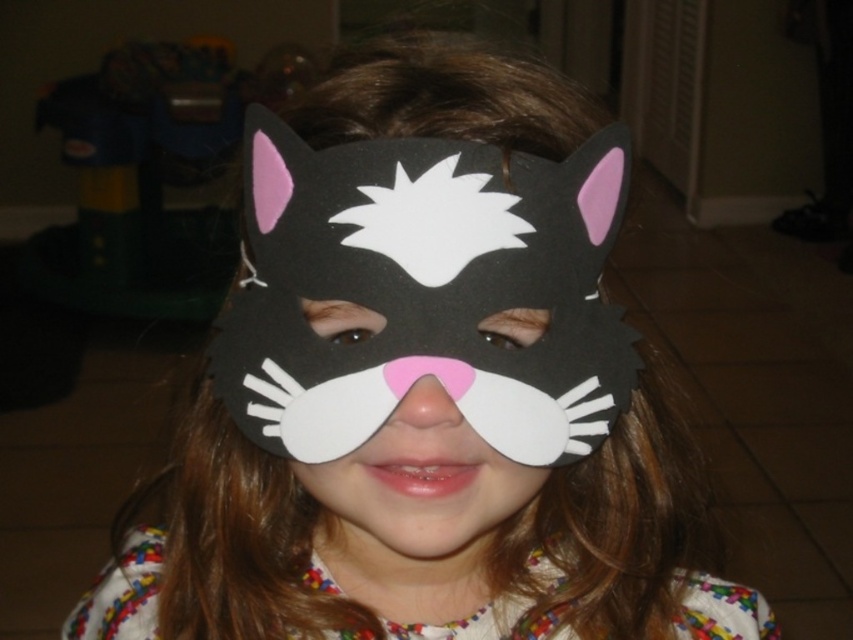
Question: Which object is farther from the camera taking this photo?

Choices:
 (A) matte felt mask at center
 (B) matte foam cat mask at center

Answer: (A)

Question: Considering the relative positions of matte foam cat mask at center and matte felt mask at center in the image provided, where is matte foam cat mask at center located with respect to matte felt mask at center?

Choices:
 (A) below
 (B) above

Answer: (B)

Question: Is matte foam cat mask at center positioned in front of matte felt mask at center?

Choices:
 (A) yes
 (B) no

Answer: (A)

Question: Can you confirm if matte foam cat mask at center is thinner than matte felt mask at center?

Choices:
 (A) no
 (B) yes

Answer: (A)